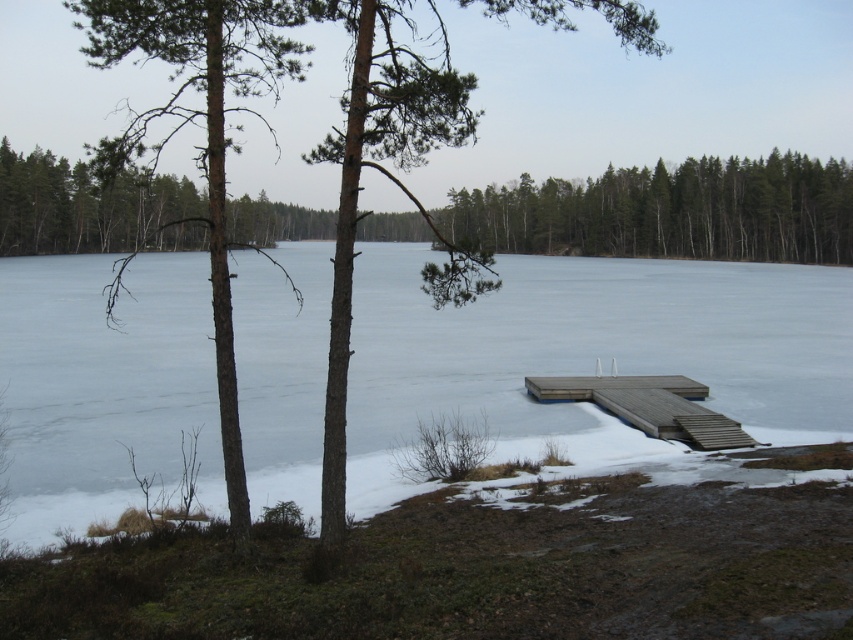
You are standing at the edge of the frozen lake and want to walk towards the brown wood tree at center. Which direction should you move relative to the frozen ice at center?

To reach the brown wood tree at center from the frozen ice at center, you should move to the right since the frozen ice at center is to the left of the brown wood tree at center.

You are planning to build a small ice sculpture on the frozen lake. The frozen ice at center and the brown wood tree at center are both visible in the scene. Which object would be a better base for the sculpture and why?

The frozen ice at center is smaller than the brown wood tree at center. Therefore, the brown wood tree at center would provide a more stable and larger base for the ice sculpture.

You are planning to walk across the frozen ice at center and the brown textured tree at center. Which one do you think is narrower?

The frozen ice at center has a lesser width compared to the brown textured tree at center, so the frozen ice at center is narrower.